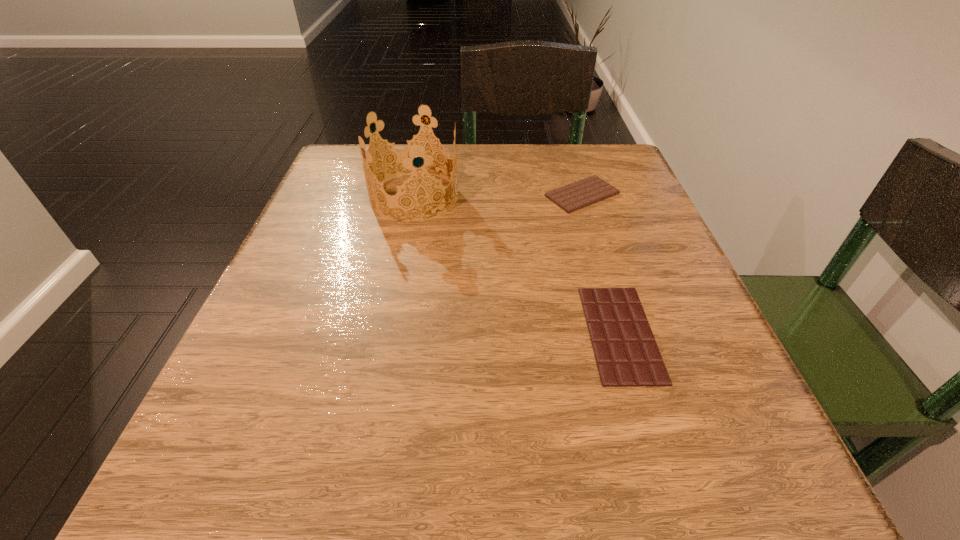
This screenshot has width=960, height=540. In the image, there is a desktop. Identify the location of free space at the near right corner. click(675, 472).

In order to click on free space that is in between the leftmost object and the nearest object in this screenshot , I will do `click(517, 265)`.

Find the location of `free space between the shortest object and the tallest object`. free space between the shortest object and the tallest object is located at coordinates (517, 265).

The image size is (960, 540). In order to click on empty space between the nearest object and the second shortest object in this screenshot , I will do `click(601, 264)`.

Where is `free space between the farther chocolate bar and the shortest object`? This screenshot has height=540, width=960. free space between the farther chocolate bar and the shortest object is located at coordinates (601, 264).

At what (x,y) coordinates should I click in order to perform the action: click on free point between the nearest object and the tallest object. Please return your answer as a coordinate pair (x, y). Image resolution: width=960 pixels, height=540 pixels. Looking at the image, I should click on (517, 265).

Find the location of a particular element. Image resolution: width=960 pixels, height=540 pixels. vacant region between the crown and the farther chocolate bar is located at coordinates (498, 195).

Find the location of a particular element. The image size is (960, 540). free spot between the nearer chocolate bar and the second shortest object is located at coordinates (601, 264).

This screenshot has height=540, width=960. I want to click on free area in between the nearest object and the taller chocolate bar, so click(601, 264).

The height and width of the screenshot is (540, 960). Find the location of `vacant space that's between the tallest object and the farther chocolate bar`. vacant space that's between the tallest object and the farther chocolate bar is located at coordinates (498, 195).